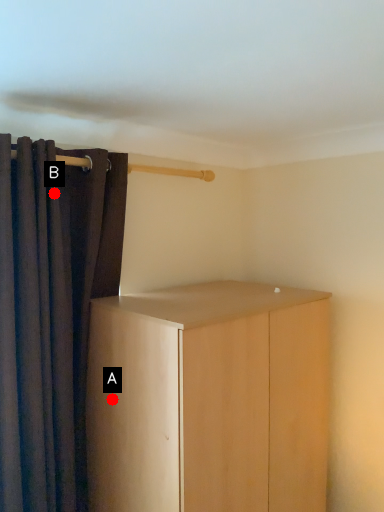
Question: Two points are circled on the image, labeled by A and B beside each circle. Which point is farther from the camera taking this photo?

Choices:
 (A) A is further
 (B) B is further

Answer: (A)